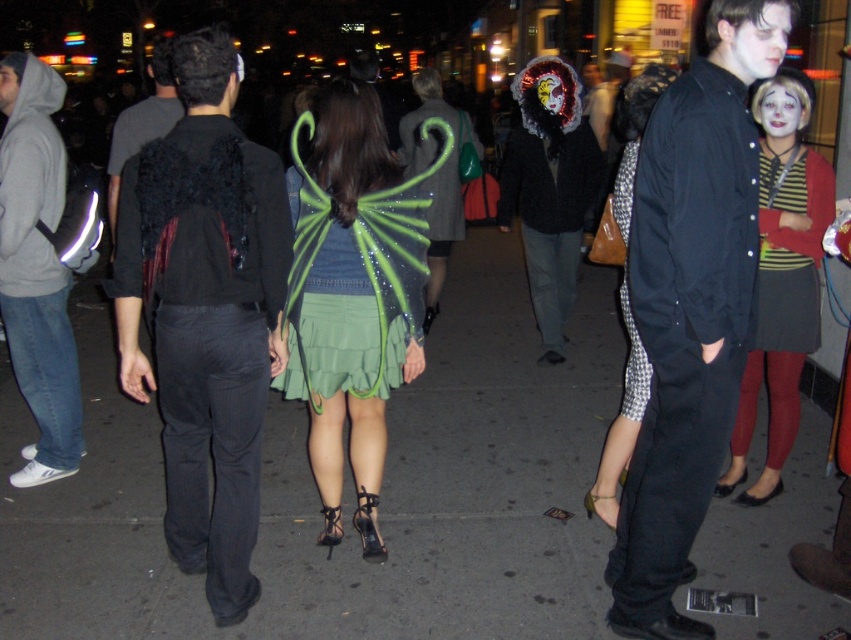
Which is in front, point (386, 396) or point (741, 40)?

Point (741, 40) is more forward.

Which is behind, point (311, 218) or point (745, 80)?

Positioned behind is point (311, 218).

Where is `green sequined dress at center`? The image size is (851, 640). green sequined dress at center is located at coordinates (352, 294).

Does striped knit dress at right come behind printed fabric skirt at center?

Yes, it is.

Measure the distance between striped knit dress at right and camera.

The distance of striped knit dress at right from camera is 3.39 meters.

This screenshot has height=640, width=851. I want to click on striped knit dress at right, so click(791, 253).

Can you confirm if green sequined dress at center is thinner than matte black jacket at center?

Correct, green sequined dress at center's width is less than matte black jacket at center's.

Which is below, green sequined dress at center or matte black jacket at center?

green sequined dress at center

Between point (384, 266) and point (595, 136), which one is positioned in front?

Point (384, 266) is more forward.

At what (x,y) coordinates should I click in order to perform the action: click on green sequined dress at center. Please return your answer as a coordinate pair (x, y). The width and height of the screenshot is (851, 640). Looking at the image, I should click on point(352,294).